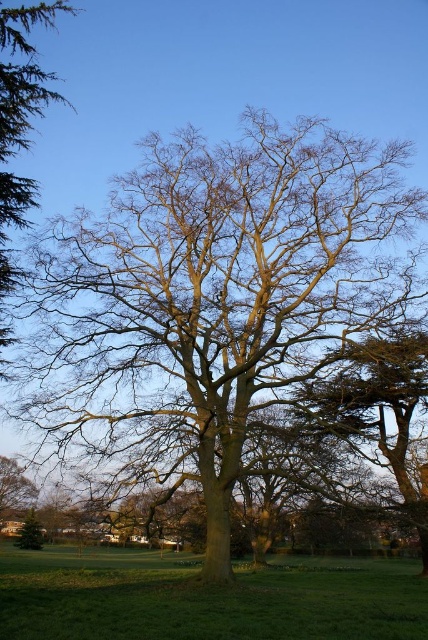
You are a bird looking for a place to perch. You see the brown rough bark tree at center and the smooth brown tree at upper left. Which tree is positioned to the right of the other?

The brown rough bark tree at center is positioned to the right of the smooth brown tree at upper left.

You are standing at the origin point in the image. Where is the brown rough bark tree at center located in terms of coordinates?

The brown rough bark tree at center is located at coordinates point (211,300).